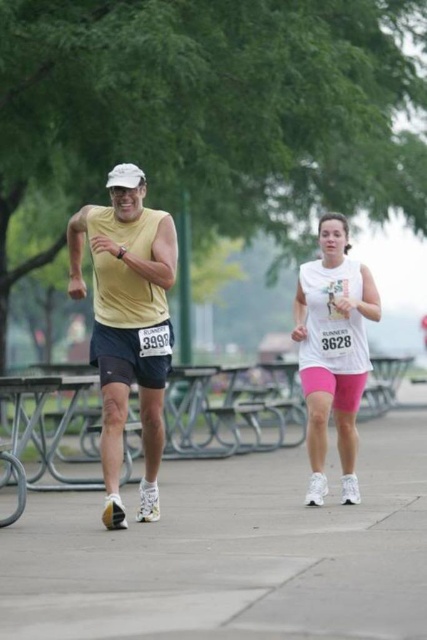
Question: Which of the following is the closest to the observer?

Choices:
 (A) (111, 221)
 (B) (307, 262)
 (C) (216, 608)

Answer: (C)

Question: Does gray concrete pavement at center lie in front of yellow matte tank top at left?

Choices:
 (A) no
 (B) yes

Answer: (B)

Question: Which of the following is the farthest from the observer?

Choices:
 (A) yellow matte tank top at left
 (B) white matte tank top at center
 (C) gray concrete pavement at center

Answer: (B)

Question: Which point is closer to the camera taking this photo?

Choices:
 (A) (342, 564)
 (B) (105, 292)

Answer: (A)

Question: Is yellow matte tank top at left further to camera compared to white matte tank top at center?

Choices:
 (A) no
 (B) yes

Answer: (A)

Question: Does gray concrete pavement at center lie behind white matte tank top at center?

Choices:
 (A) yes
 (B) no

Answer: (B)